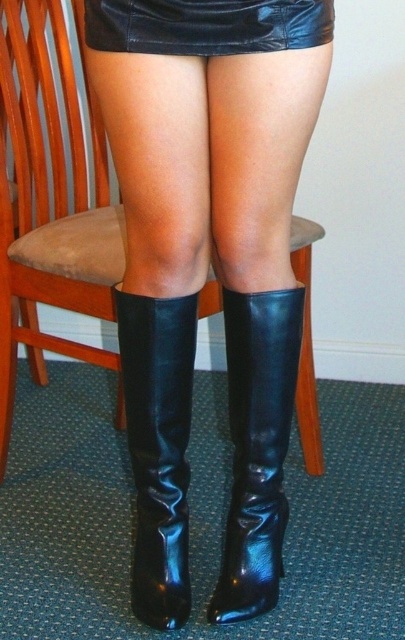
Question: Is wooden chair at center closer to the viewer compared to shiny black boot at lower center?

Choices:
 (A) yes
 (B) no

Answer: (B)

Question: Is shiny black boot at center to the right of shiny black boot at lower center from the viewer's perspective?

Choices:
 (A) no
 (B) yes

Answer: (B)

Question: Does wooden chair at center appear on the left side of black leather skirt at upper center?

Choices:
 (A) no
 (B) yes

Answer: (B)

Question: Which of the following is the closest to the observer?

Choices:
 (A) (317, 454)
 (B) (166, 22)
 (C) (189, 472)
 (D) (264, 488)

Answer: (B)

Question: Which point is farther to the camera?

Choices:
 (A) shiny black boot at lower center
 (B) shiny black boot at center
 (C) black leather skirt at upper center

Answer: (B)

Question: Which of the following is the farthest from the observer?

Choices:
 (A) shiny black boot at lower center
 (B) black leather skirt at upper center
 (C) shiny black boot at center
 (D) wooden chair at center

Answer: (D)